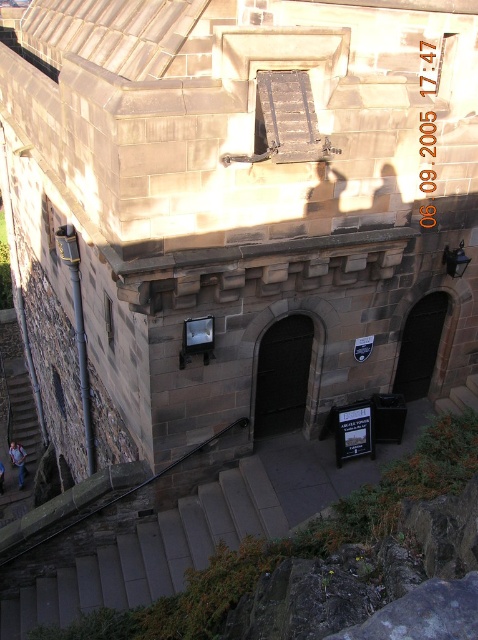
You are standing at the bottom of the stairs near the blue jeans at bottom left and want to enter the historic stone building through the dark stone door at center. Which direction should you move to reach the door?

You should move upward towards the dark stone door at center since it is located above the blue jeans at bottom left and in front of it.

From the picture: You are standing at the base of the smooth stone stairs at lower center. What are the coordinates of the point where you are standing?

The coordinates of the point where you are standing are at point (152, 552).